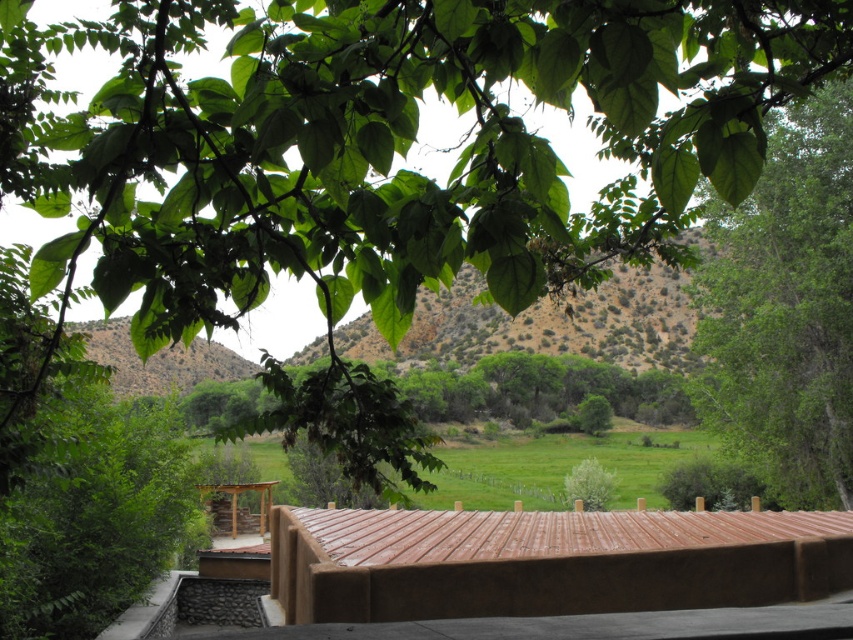
Does brown corrugated metal roof at center have a greater width compared to green leafy tree at right?

Indeed, brown corrugated metal roof at center has a greater width compared to green leafy tree at right.

This screenshot has height=640, width=853. I want to click on brown corrugated metal roof at center, so click(x=547, y=561).

Is point (669, 579) less distant than point (813, 404)?

Yes, point (669, 579) is closer to viewer.

Find the location of a particular element. brown corrugated metal roof at center is located at coordinates (547, 561).

Can you confirm if brown corrugated metal roof at center is smaller than dull brown hillside at center?

Yes.

The width and height of the screenshot is (853, 640). I want to click on brown corrugated metal roof at center, so click(547, 561).

Can you confirm if green leafy tree at right is positioned to the right of dull brown hillside at center?

Correct, you'll find green leafy tree at right to the right of dull brown hillside at center.

Describe the element at coordinates (785, 308) in the screenshot. I see `green leafy tree at right` at that location.

What are the coordinates of `green leafy tree at right` in the screenshot? It's located at (785, 308).